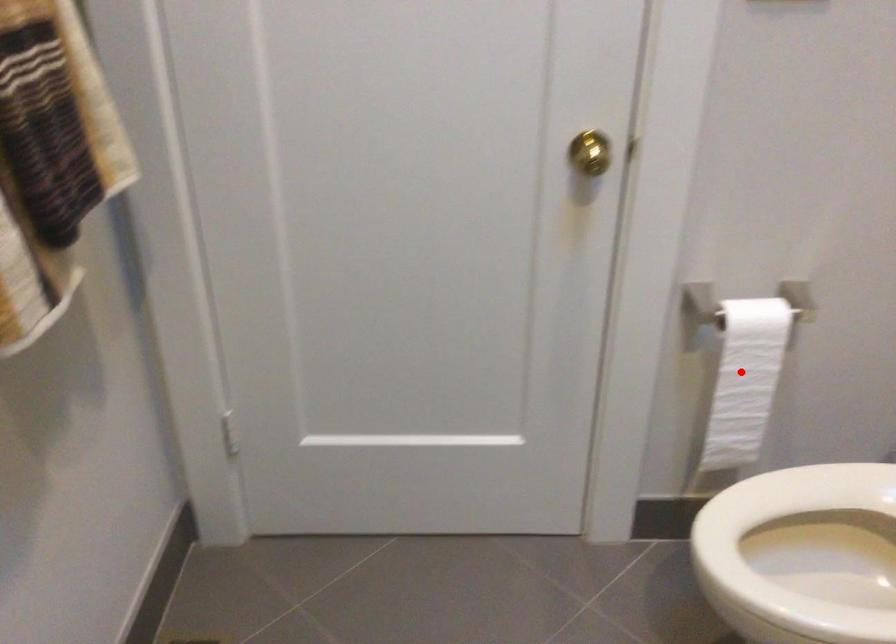
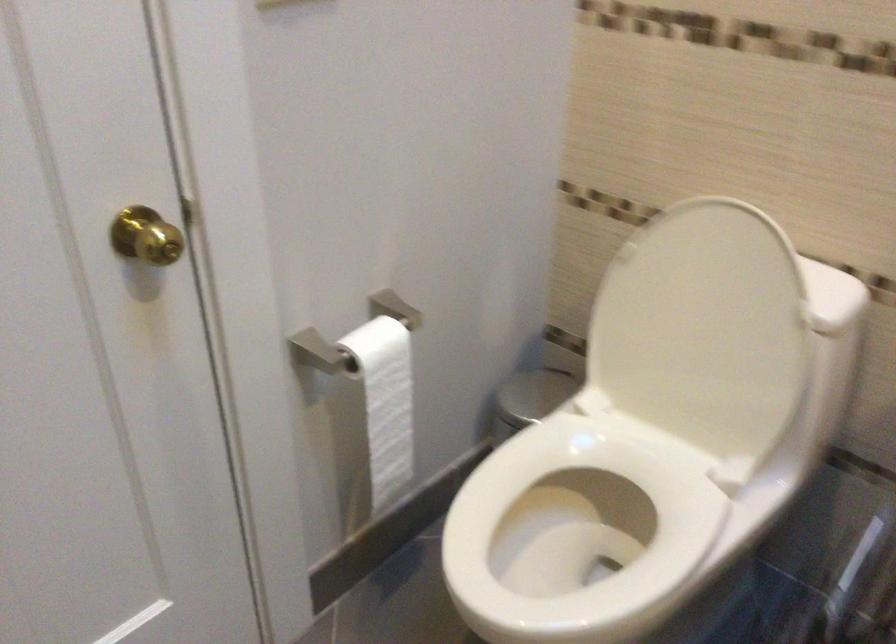
Locate, in the second image, the point that corresponds to the highlighted location in the first image.

(385, 402)